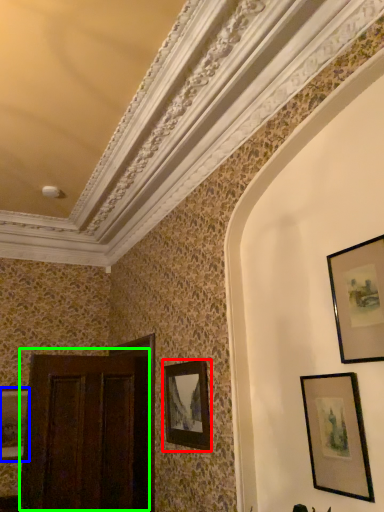
Question: Based on their relative distances, which object is farther from picture frame (highlighted by a red box)? Choose from picture frame (highlighted by a blue box) and door (highlighted by a green box).

Choices:
 (A) picture frame
 (B) door

Answer: (A)